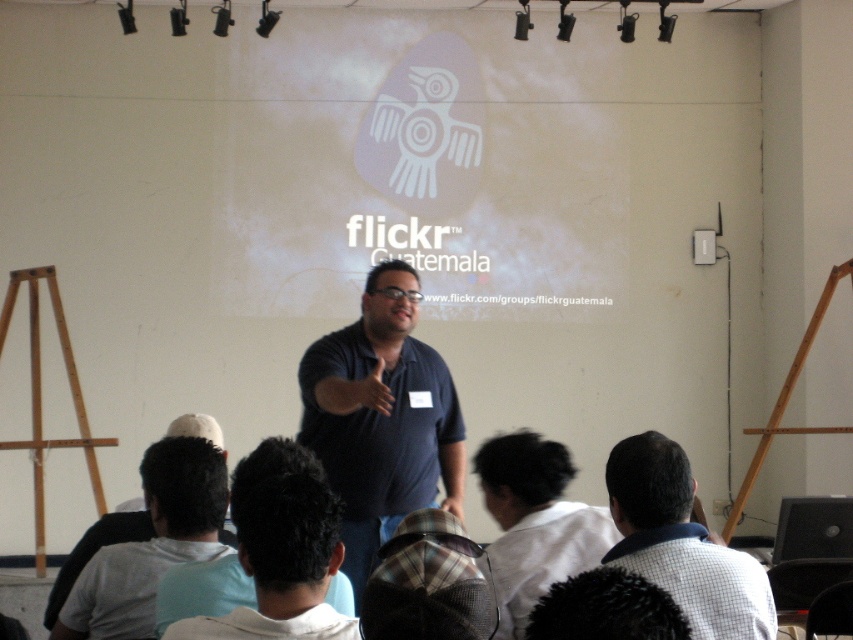
Based on the scene described, which object is positioned to the left of the other? The gray fabric shirt at lower left or the dark hair at center?

The gray fabric shirt at lower left is positioned to the left of the dark hair at center because it is located at the lower left, while the dark hair at center is centrally placed.

You are attending a presentation and want to locate the presenter. Where is the dark blue shirt at center located in the room?

The dark blue shirt at center is located at point (381, 419) in the room.